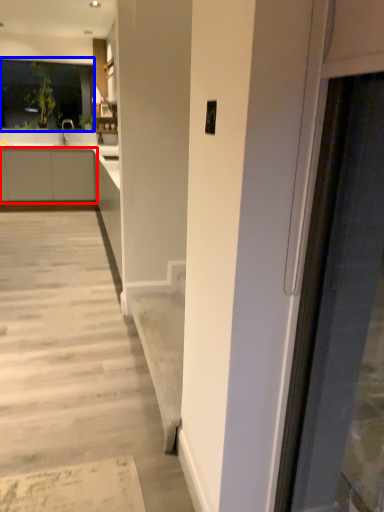
Question: Which point is closer to the camera, cabinetry (highlighted by a red box) or window (highlighted by a blue box)?

Choices:
 (A) cabinetry
 (B) window

Answer: (A)